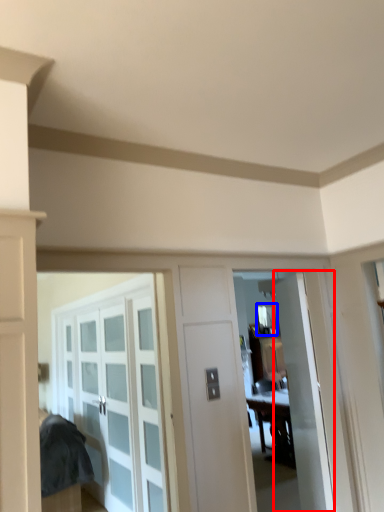
Question: Which of the following is the closest to the observer, door (highlighted by a red box) or window (highlighted by a blue box)?

Choices:
 (A) door
 (B) window

Answer: (A)